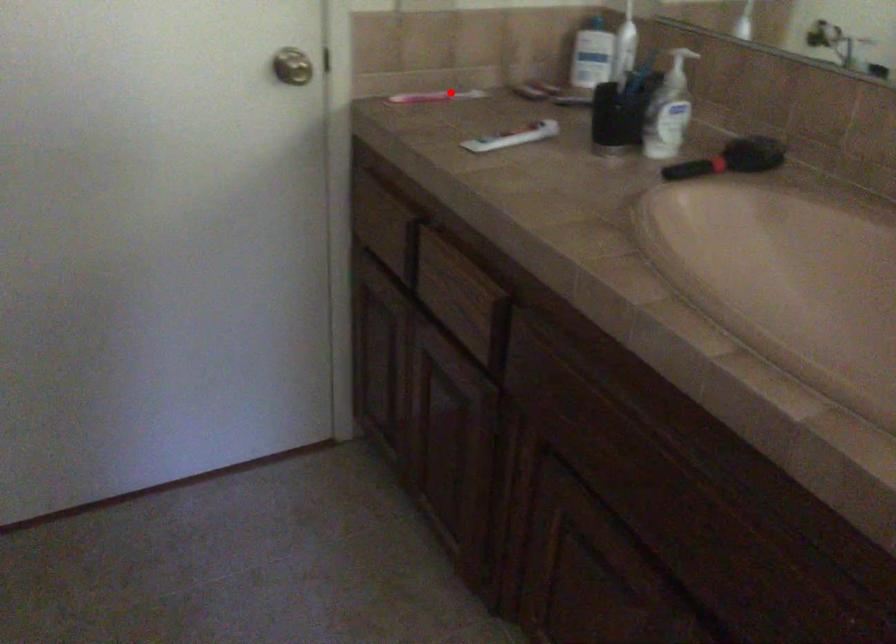
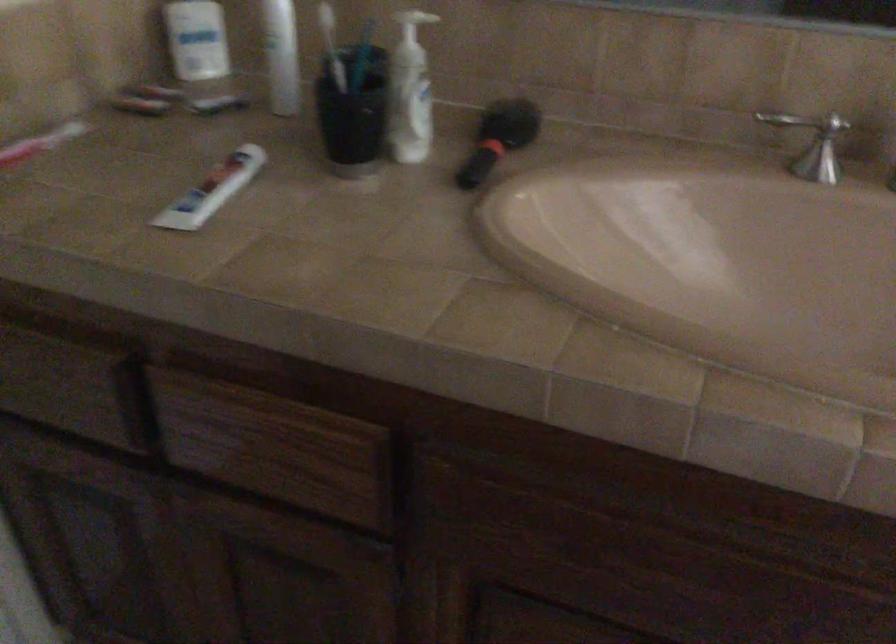
Question: I am providing you with two images of the same scene from different viewpoints. A red point is marked on the first image. Is the red point's position out of view in image 2?

Choices:
 (A) Yes
 (B) No

Answer: (B)